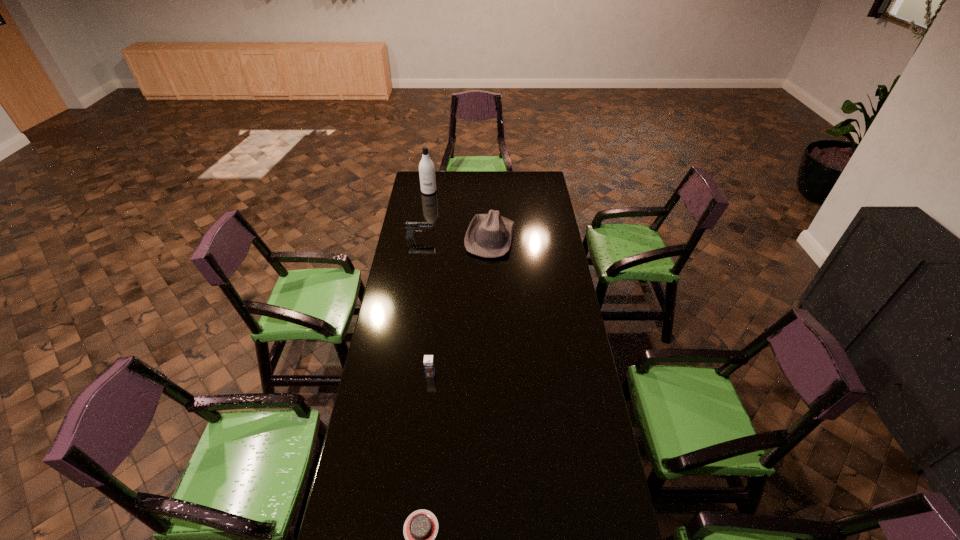
Find the location of a particular element. Image resolution: width=960 pixels, height=540 pixels. vacant region between the farthest object and the fourth shortest object is located at coordinates (460, 214).

Identify the location of object that stands as the fourth closest to the pistol. The image size is (960, 540). (420, 529).

You are a GUI agent. You are given a task and a screenshot of the screen. Output one action in this format:
    pyautogui.click(x=<x>, y=<y>)
    Task: Click on the object that is the fourth nearest to the second nearest object
    
    Given the screenshot: What is the action you would take?
    pyautogui.click(x=426, y=167)

Where is `free space that satisfies the following two spatial constraints: 1. on the front-facing side of the shampoo; 2. on the right side of the second tallest object`? Image resolution: width=960 pixels, height=540 pixels. free space that satisfies the following two spatial constraints: 1. on the front-facing side of the shampoo; 2. on the right side of the second tallest object is located at coordinates (421, 237).

Identify the location of blank area in the image that satisfies the following two spatial constraints: 1. on the front-facing side of the farthest object; 2. aim along the barrel of the pistol. (421, 238).